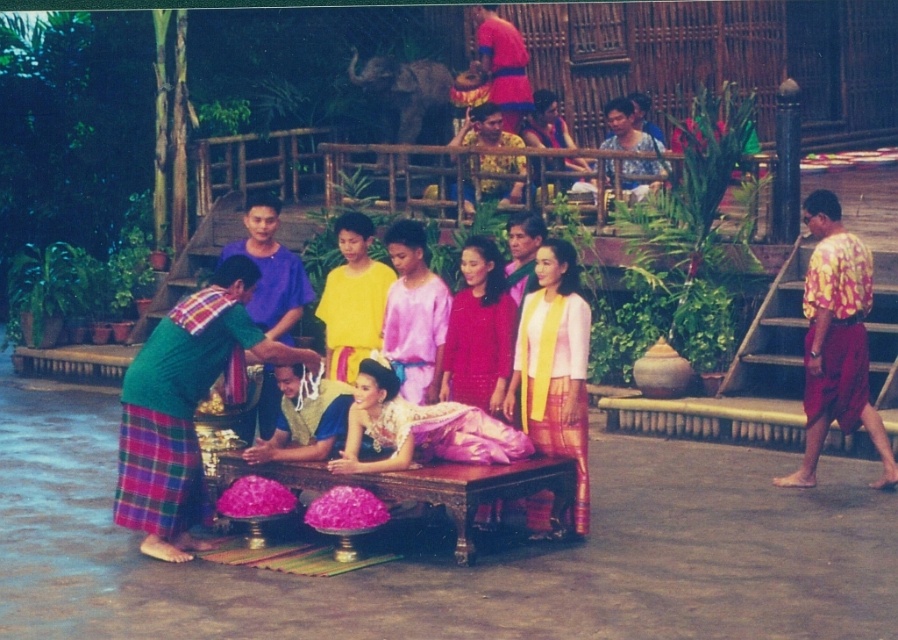
You are a photographer at the event and want to capture both the matte pink dress at center and the pink satin dress at center in a single shot. Which dress is positioned lower in the frame?

The matte pink dress at center is located below the pink satin dress at center, so it is positioned lower in the frame.

You are a photographer at the event and want to capture both the pink satin dress at center and the yellow satin shirt at center in a single frame. Which object should you focus on first to ensure both are in the shot?

You should focus on the yellow satin shirt at center first because it occupies more space and will help ensure both the pink satin dress at center and the yellow satin shirt at center are captured in the frame.